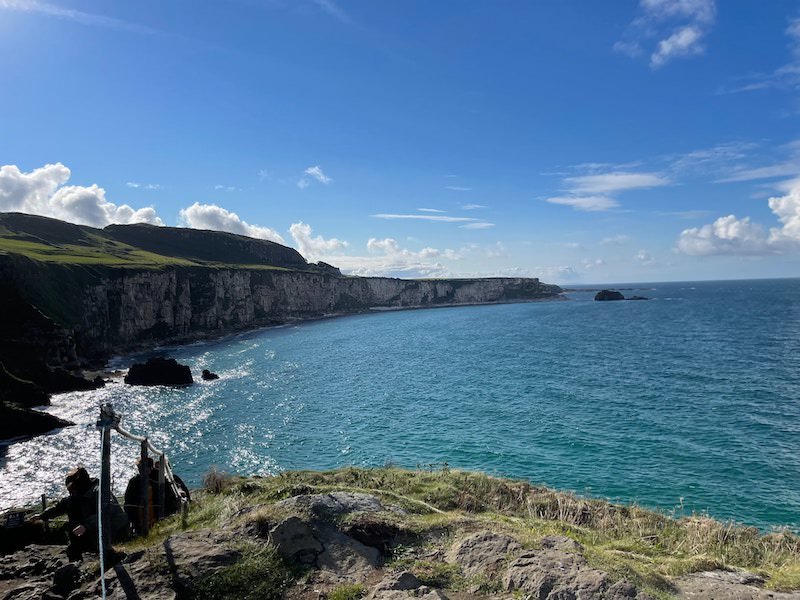
You are a GUI agent. You are given a task and a screenshot of the screen. Output one action in this format:
    pyautogui.click(x=<x>, y=<y>)
    Task: Click on the ]light
    The width and height of the screenshot is (800, 600).
    Given the screenshot: What is the action you would take?
    pyautogui.click(x=85, y=446)